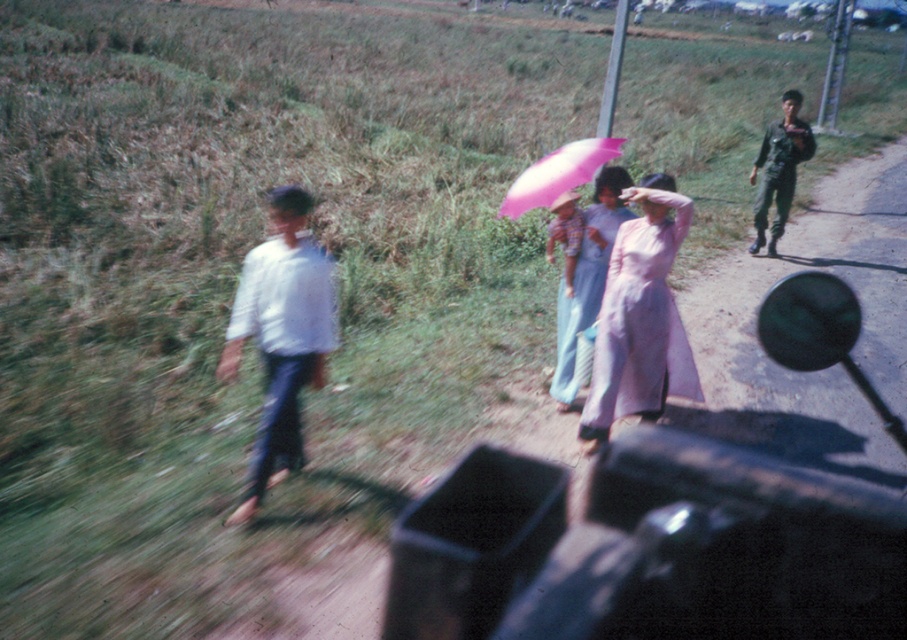
Question: Does white cotton shirt at left appear on the left side of pale pink silk ao dai at center?

Choices:
 (A) yes
 (B) no

Answer: (A)

Question: Is pale pink silk ao dai at center bigger than pink fabric dress at center?

Choices:
 (A) no
 (B) yes

Answer: (B)

Question: Which point is closer to the camera?

Choices:
 (A) dark green uniform at right
 (B) pale pink silk ao dai at center

Answer: (B)

Question: Observing the image, what is the correct spatial positioning of white cotton shirt at left in reference to pink fabric dress at center?

Choices:
 (A) left
 (B) right

Answer: (A)

Question: Estimate the real-world distances between objects in this image. Which object is closer to the dark green uniform at right?

Choices:
 (A) pink fabric dress at center
 (B) pink matte umbrella at center
 (C) white cotton shirt at left
 (D) pale pink silk ao dai at center

Answer: (A)

Question: Which object is positioned closest to the dark green uniform at right?

Choices:
 (A) pink fabric dress at center
 (B) pink matte umbrella at center
 (C) white cotton shirt at left

Answer: (A)